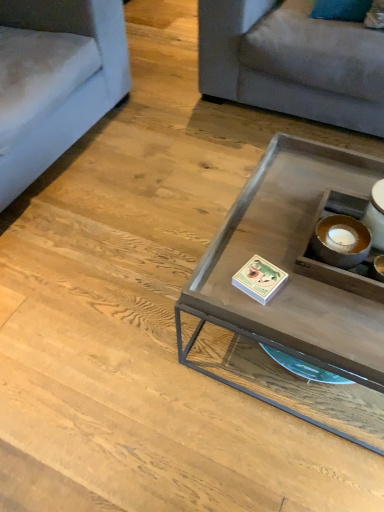
At what (x,y) coordinates should I click in order to perform the action: click on unoccupied space behind matte glass coffee table at center. Please return your answer as a coordinate pair (x, y). Looking at the image, I should click on (199, 175).